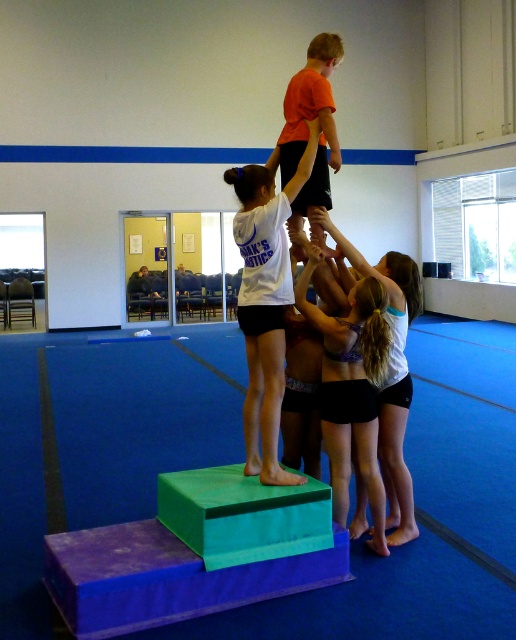
Who is lower down, white matte shirt at center or purple fabric shorts at center?

purple fabric shorts at center

Locate an element on the screen. The height and width of the screenshot is (640, 516). white matte shirt at center is located at coordinates (266, 301).

Measure the distance between point (261, 308) and camera.

Point (261, 308) and camera are 4.17 meters apart from each other.

The width and height of the screenshot is (516, 640). In order to click on white matte shirt at center in this screenshot , I will do `click(266, 301)`.

Does white matte shirt at center appear under orange matte shirt at upper center?

Indeed, white matte shirt at center is positioned under orange matte shirt at upper center.

Which is more to the right, white matte shirt at center or orange matte shirt at upper center?

orange matte shirt at upper center

Where is `white matte shirt at center`? white matte shirt at center is located at coordinates (266, 301).

At what (x,y) coordinates should I click in order to perform the action: click on white matte shirt at center. Please return your answer as a coordinate pair (x, y). Looking at the image, I should click on (266, 301).

Is point (368, 300) farther from viewer compared to point (314, 234)?

That is False.

Between point (332, 417) and point (320, 150), which one is positioned behind?

Point (320, 150)

Identify the location of purple fabric shorts at center. (350, 392).